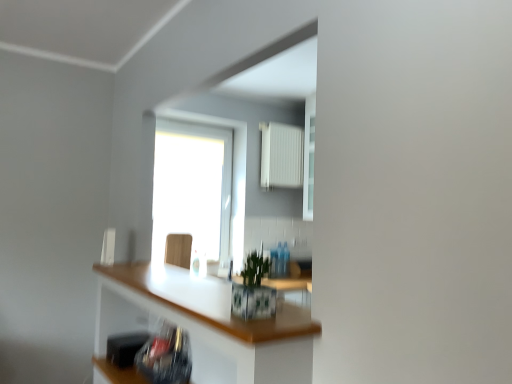
Question: Does transparent glass window at center appear on the right side of black plastic toaster at lower left?

Choices:
 (A) no
 (B) yes

Answer: (B)

Question: From the image's perspective, is transparent glass window at center above black plastic toaster at lower left?

Choices:
 (A) yes
 (B) no

Answer: (A)

Question: Is transparent glass window at center facing away from black plastic toaster at lower left?

Choices:
 (A) yes
 (B) no

Answer: (B)

Question: Considering the relative positions of transparent glass window at center and black plastic toaster at lower left in the image provided, is transparent glass window at center in front of black plastic toaster at lower left?

Choices:
 (A) no
 (B) yes

Answer: (A)

Question: From a real-world perspective, does transparent glass window at center sit lower than black plastic toaster at lower left?

Choices:
 (A) yes
 (B) no

Answer: (B)

Question: Would you say wooden swivel chair at center is to the left or to the right of black plastic toaster at lower left in the picture?

Choices:
 (A) right
 (B) left

Answer: (A)

Question: Is point (186, 254) positioned closer to the camera than point (129, 349)?

Choices:
 (A) closer
 (B) farther

Answer: (B)

Question: Is wooden swivel chair at center taller or shorter than black plastic toaster at lower left?

Choices:
 (A) tall
 (B) short

Answer: (A)

Question: In the image, is wooden swivel chair at center positioned in front of or behind black plastic toaster at lower left?

Choices:
 (A) front
 (B) behind

Answer: (B)

Question: Is white glossy countertop at center situated inside white plastic radiator at upper center or outside?

Choices:
 (A) outside
 (B) inside

Answer: (A)

Question: From a real-world perspective, is white glossy countertop at center above or below white plastic radiator at upper center?

Choices:
 (A) above
 (B) below

Answer: (B)

Question: Relative to white plastic radiator at upper center, is white glossy countertop at center in front or behind?

Choices:
 (A) front
 (B) behind

Answer: (A)

Question: From their relative heights in the image, would you say white glossy countertop at center is taller or shorter than white plastic radiator at upper center?

Choices:
 (A) tall
 (B) short

Answer: (A)

Question: Does point (204, 291) appear closer or farther from the camera than point (172, 236)?

Choices:
 (A) closer
 (B) farther

Answer: (A)

Question: In the image, is white glossy countertop at center on the left side or the right side of wooden swivel chair at center?

Choices:
 (A) left
 (B) right

Answer: (B)